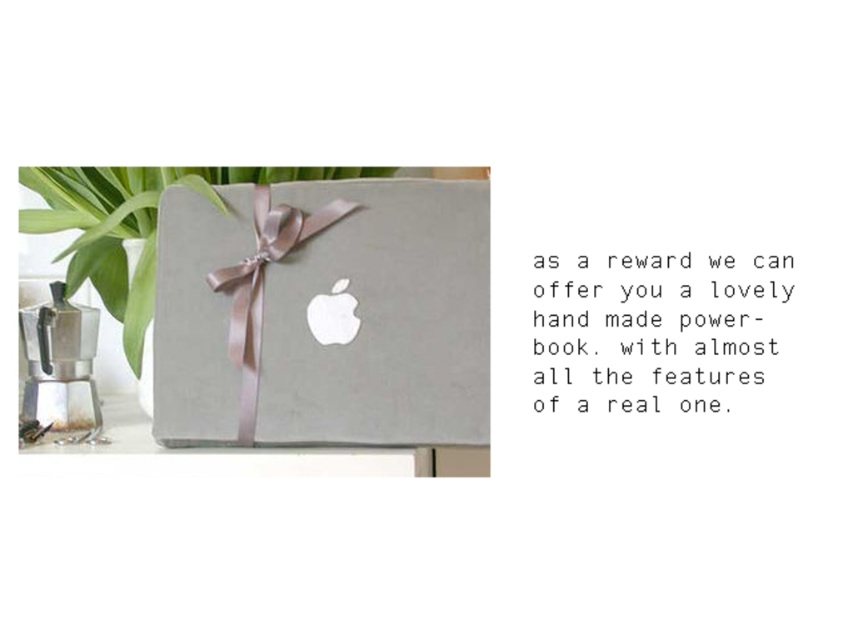
Question: Observing the image, what is the correct spatial positioning of satin gray box at center in reference to silky pink ribbon at center?

Choices:
 (A) below
 (B) above

Answer: (A)

Question: Which object appears farthest from the camera in this image?

Choices:
 (A) silky pink ribbon at center
 (B) satin gray box at center

Answer: (A)

Question: Which point appears closest to the camera in this image?

Choices:
 (A) (254, 342)
 (B) (248, 348)

Answer: (A)

Question: Does satin gray box at center appear on the right side of silky pink ribbon at center?

Choices:
 (A) yes
 (B) no

Answer: (A)

Question: Which object appears farthest from the camera in this image?

Choices:
 (A) silky pink ribbon at center
 (B) satin gray box at center

Answer: (A)

Question: Does satin gray box at center have a smaller size compared to silky pink ribbon at center?

Choices:
 (A) no
 (B) yes

Answer: (A)